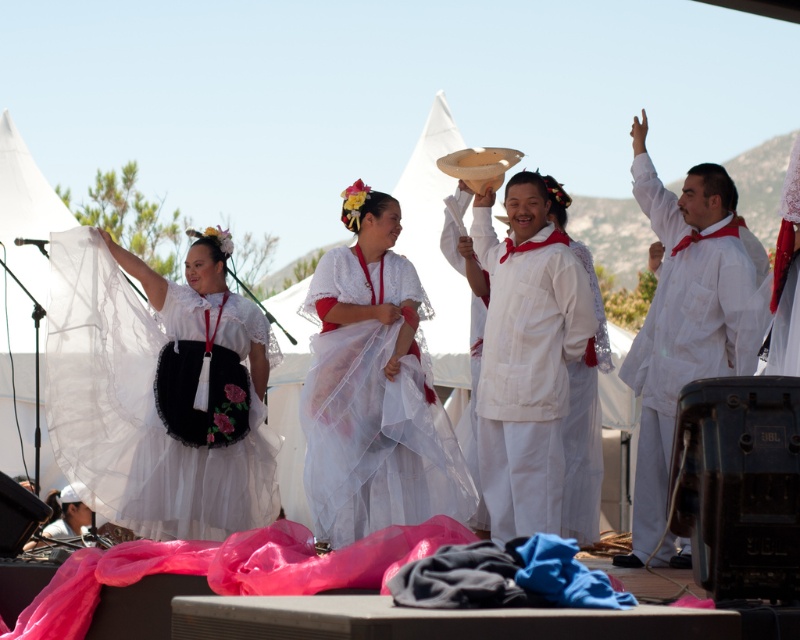
You are a photographer standing behind the dancers. You want to take a photo that includes both the white sheer dress at center and the white cotton dress at center. Given that your camera has a focal length of 50mm and a sensor size of 24mm x 36mm, what is the minimum distance you need to stand from the stage to ensure both dresses are fully in frame?

The distance between the white sheer dress at center and the white cotton dress at center is 1.09 meters. To calculate the minimum distance required, use the formula for depth of field or field of view. However, since the question specifies ensuring both are fully in frame, the critical factor is the camera sensor and focal length. The field of view width for a 50mm lens on a 24x36mm sensor is approximately 46 degrees horizontally. Using trigonometry, the maximum subject distance where the 1.09m separation

You are a photographer standing 2 meters away from the stage. You want to capture both the white cotton dress at center and the white sheer robe at right in a single photo without zooming. Can you fit them both in the frame if your camera has a 1.2 meter wide field of view?

The distance between the white cotton dress at center and the white sheer robe at right is 1.17 meters, which is less than the camera field of view of 1.2 meters. Therefore, you can fit both the white cotton dress at center and the white sheer robe at right in the frame without zooming.